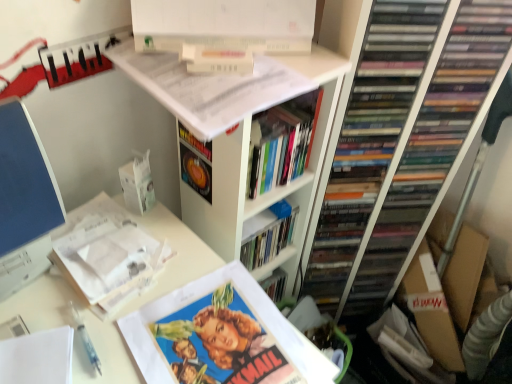
Question: Is point (279, 127) closer or farther from the camera than point (182, 51)?

Choices:
 (A) closer
 (B) farther

Answer: (B)

Question: From a real-world perspective, relative to white matte book at upper center, marked as the 1th book in a top-to-bottom arrangement, is hardcover book at center, placed as the third book when sorted from bottom to top, vertically above or below?

Choices:
 (A) above
 (B) below

Answer: (B)

Question: Which of these objects is positioned closest to the white paper at upper left, positioned as the 2th book in bottom-to-top order?

Choices:
 (A) vintage paper movie poster at center, which is the fourth book in top-to-bottom order
 (B) hardcover book at center, positioned as the second book in top-to-bottom order
 (C) white matte bookshelf at upper center
 (D) white matte book at upper center, positioned as the fourth book in bottom-to-top order
 (E) white paper at upper left

Answer: (E)

Question: Based on their relative distances, which object is farther from the hardcover book at center, positioned as the second book in top-to-bottom order?

Choices:
 (A) white paper at upper left, which appears as the third book when viewed from the top
 (B) white matte book at upper center, positioned as the fourth book in bottom-to-top order
 (C) white paper at upper left
 (D) white matte bookshelf at upper center
 (E) vintage paper movie poster at center, which is the fourth book in top-to-bottom order

Answer: (A)